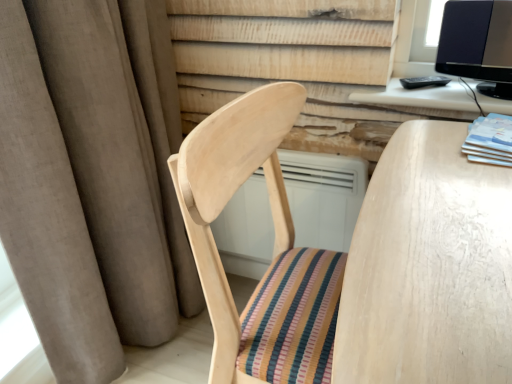
Question: Does matte blue book at right come behind brown fabric curtain at left?

Choices:
 (A) no
 (B) yes

Answer: (B)

Question: Considering the relative sizes of matte blue book at right and brown fabric curtain at left in the image provided, is matte blue book at right bigger than brown fabric curtain at left?

Choices:
 (A) no
 (B) yes

Answer: (A)

Question: Is matte blue book at right looking in the opposite direction of brown fabric curtain at left?

Choices:
 (A) yes
 (B) no

Answer: (B)

Question: Could you tell me if matte blue book at right is facing brown fabric curtain at left?

Choices:
 (A) no
 (B) yes

Answer: (A)

Question: From a real-world perspective, is matte blue book at right beneath brown fabric curtain at left?

Choices:
 (A) yes
 (B) no

Answer: (B)

Question: Considering the relative sizes of matte blue book at right and brown fabric curtain at left in the image provided, is matte blue book at right smaller than brown fabric curtain at left?

Choices:
 (A) yes
 (B) no

Answer: (A)

Question: Is matte blue book at right oriented away from black glossy monitor at upper right?

Choices:
 (A) no
 (B) yes

Answer: (A)

Question: Is matte blue book at right taller than black glossy monitor at upper right?

Choices:
 (A) no
 (B) yes

Answer: (A)

Question: Is matte blue book at right to the left of black glossy monitor at upper right from the viewer's perspective?

Choices:
 (A) no
 (B) yes

Answer: (A)

Question: Can you confirm if matte blue book at right is bigger than black glossy monitor at upper right?

Choices:
 (A) no
 (B) yes

Answer: (A)

Question: From a real-world perspective, is matte blue book at right located higher than black glossy monitor at upper right?

Choices:
 (A) yes
 (B) no

Answer: (B)

Question: Is matte blue book at right outside of black glossy monitor at upper right?

Choices:
 (A) yes
 (B) no

Answer: (A)

Question: Is white wood computer desk at upper right smaller than matte blue book at right?

Choices:
 (A) yes
 (B) no

Answer: (B)